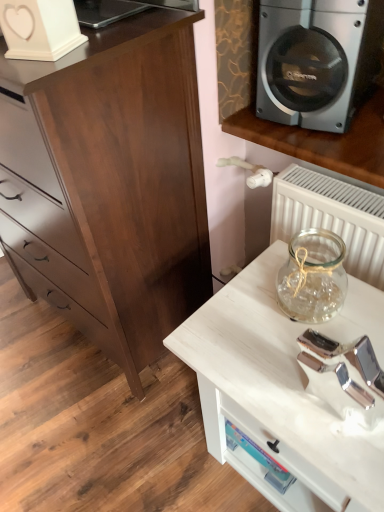
Question: From the image's perspective, is dark wood chest of drawers at left on top of silver metallic speaker at upper right?

Choices:
 (A) no
 (B) yes

Answer: (A)

Question: Is dark wood chest of drawers at left taller than silver metallic speaker at upper right?

Choices:
 (A) no
 (B) yes

Answer: (B)

Question: Is silver metallic speaker at upper right a part of dark wood chest of drawers at left?

Choices:
 (A) yes
 (B) no

Answer: (B)

Question: From the image's perspective, is dark wood chest of drawers at left located beneath silver metallic speaker at upper right?

Choices:
 (A) yes
 (B) no

Answer: (A)

Question: Is dark wood chest of drawers at left positioned behind silver metallic speaker at upper right?

Choices:
 (A) yes
 (B) no

Answer: (B)

Question: From a real-world perspective, is dark wood chest of drawers at left positioned under silver metallic speaker at upper right based on gravity?

Choices:
 (A) yes
 (B) no

Answer: (A)

Question: Is white matte heart-shaped object at upper left facing towards silver metallic speaker at upper right?

Choices:
 (A) no
 (B) yes

Answer: (A)

Question: Is white matte heart-shaped object at upper left not inside silver metallic speaker at upper right?

Choices:
 (A) no
 (B) yes

Answer: (B)

Question: Is white matte heart-shaped object at upper left wider than silver metallic speaker at upper right?

Choices:
 (A) yes
 (B) no

Answer: (B)

Question: Can you confirm if white matte heart-shaped object at upper left is smaller than silver metallic speaker at upper right?

Choices:
 (A) no
 (B) yes

Answer: (B)

Question: From the image's perspective, would you say white matte heart-shaped object at upper left is shown under silver metallic speaker at upper right?

Choices:
 (A) yes
 (B) no

Answer: (A)

Question: Is white matte heart-shaped object at upper left thinner than silver metallic speaker at upper right?

Choices:
 (A) no
 (B) yes

Answer: (B)

Question: From a real-world perspective, is silver metallic speaker at upper right located beneath white wood table at lower right?

Choices:
 (A) yes
 (B) no

Answer: (B)